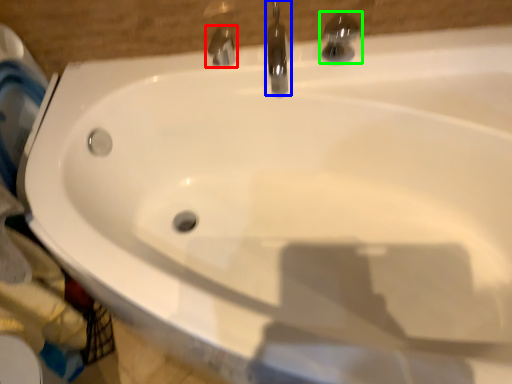
Question: Which is nearer to the tap (highlighted by a red box)? tap (highlighted by a blue box) or tap (highlighted by a green box).

Choices:
 (A) tap
 (B) tap

Answer: (A)